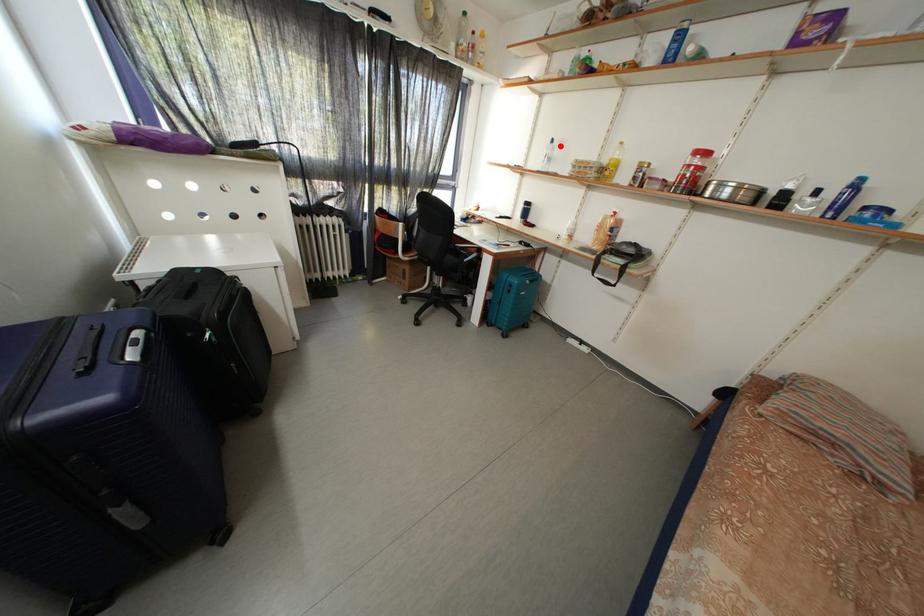
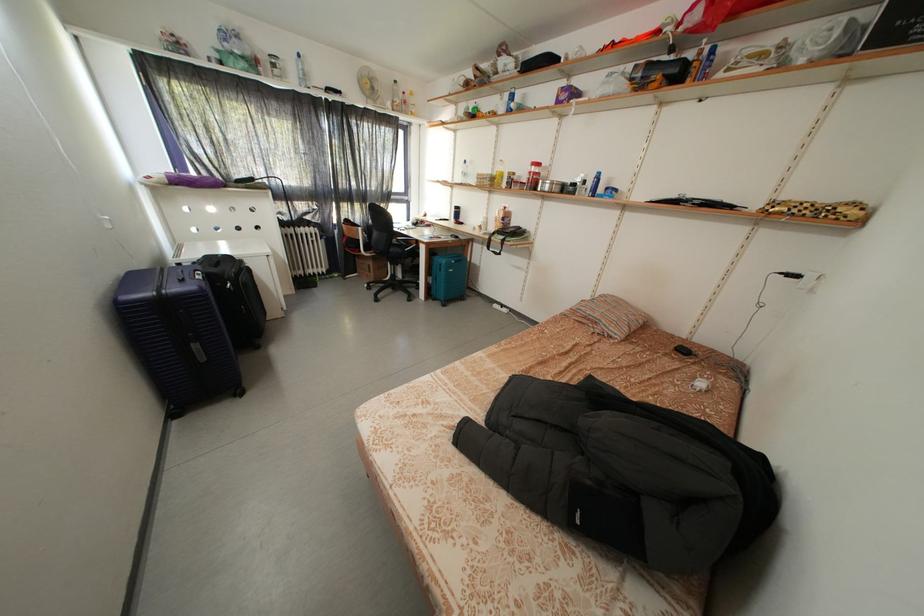
Locate, in the second image, the point that corresponds to the highlighted location in the first image.

(472, 167)